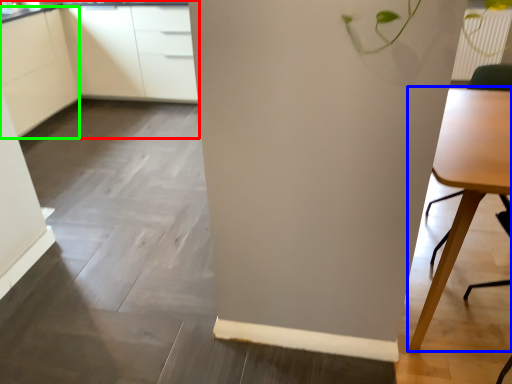
Question: Based on their relative distances, which object is farther from cabinetry (highlighted by a red box)? Choose from table (highlighted by a blue box) and cabinetry (highlighted by a green box).

Choices:
 (A) table
 (B) cabinetry

Answer: (A)